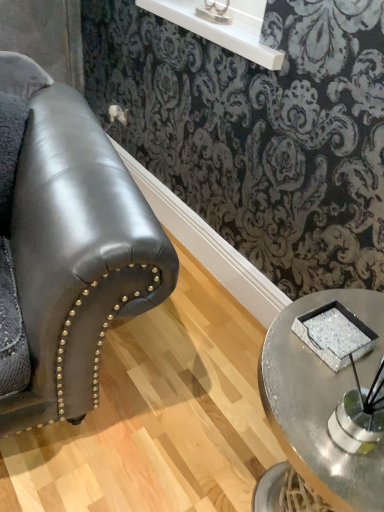
Identify the location of free point behind metallic silver tray at lower right. The image size is (384, 512). (314, 359).